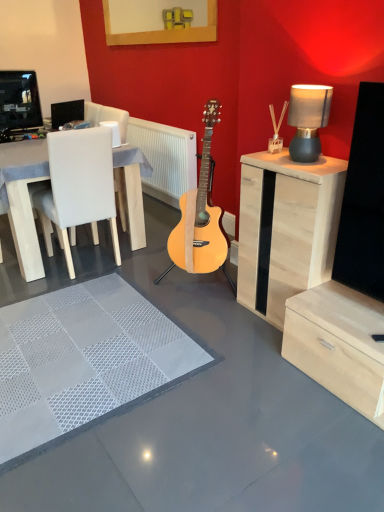
This screenshot has height=512, width=384. What do you see at coordinates (164, 31) in the screenshot?
I see `wooden picture frame at upper center` at bounding box center [164, 31].

Identify the location of light wood cabinet at right. The image size is (384, 512). (286, 228).

The width and height of the screenshot is (384, 512). Describe the element at coordinates (308, 120) in the screenshot. I see `matte gray lampshade at upper right` at that location.

Find the location of a particular element. The height and width of the screenshot is (512, 384). black plastic speaker at upper left is located at coordinates (66, 112).

In order to click on wooden picture frame at upper center in this screenshot , I will do `click(164, 31)`.

From a real-world perspective, which object rests below the other?

light wood acoustic guitar at center, from a real-world perspective.

Consider the image. What's the angular difference between light wood acoustic guitar at center and matte gray lampshade at upper right's facing directions?

They differ by 2.68 degrees in their facing directions.

Is light wood acoustic guitar at center taller than matte gray lampshade at upper right?

Correct, light wood acoustic guitar at center is much taller as matte gray lampshade at upper right.

Considering the relative sizes of light wood acoustic guitar at center and matte gray lampshade at upper right in the image provided, is light wood acoustic guitar at center thinner than matte gray lampshade at upper right?

In fact, light wood acoustic guitar at center might be wider than matte gray lampshade at upper right.

How many degrees apart are the facing directions of light wood cabinet at right and matte gray lampshade at upper right?

They differ by 2.68 degrees in their facing directions.

Is point (318, 268) less distant than point (319, 144)?

Yes.

Is light wood cabinet at right with matte gray lampshade at upper right?

No, light wood cabinet at right is not beside matte gray lampshade at upper right.

Considering the relative positions of black plastic speaker at upper left and light wood acoustic guitar at center in the image provided, is black plastic speaker at upper left in front of light wood acoustic guitar at center?

No, the depth of black plastic speaker at upper left is greater than that of light wood acoustic guitar at center.

Are black plastic speaker at upper left and light wood acoustic guitar at center located far from each other?

Yes.

Is black plastic speaker at upper left situated inside light wood acoustic guitar at center or outside?

The correct answer is: outside.

From a real-world perspective, is light wood cabinet at right physically above white textured rug at center?

Yes, from a real-world perspective, light wood cabinet at right is above white textured rug at center.

Who is taller, light wood cabinet at right or white textured rug at center?

With more height is light wood cabinet at right.

Is point (276, 277) closer or farther from the camera than point (129, 389)?

Point (276, 277) appears to be farther away from the viewer than point (129, 389).

Which object is thinner, light wood cabinet at right or white textured rug at center?

With smaller width is light wood cabinet at right.

Between white textured rug at center and white textured radiator at center, which one is positioned behind?

white textured radiator at center is further from the camera.

From the image's perspective, relative to white textured radiator at center, is white textured rug at center above or below?

white textured rug at center is situated lower than white textured radiator at center in the image.

Which of these two, white textured rug at center or white textured radiator at center, stands taller?

white textured radiator at center.

How many degrees apart are the facing directions of white textured rug at center and white textured radiator at center?

The angle between the facing direction of white textured rug at center and the facing direction of white textured radiator at center is 88.7 degrees.

Are white textured radiator at center and black plastic speaker at upper left located far from each other?

Absolutely, white textured radiator at center is distant from black plastic speaker at upper left.

What's the angular difference between white textured radiator at center and black plastic speaker at upper left's facing directions?

3.3 degrees.

Can you confirm if white textured radiator at center is positioned to the right of black plastic speaker at upper left?

Yes.

Does white textured radiator at center lie in front of black plastic speaker at upper left?

No, white textured radiator at center is further to the viewer.

Is white textured radiator at center outside of wooden picture frame at upper center?

white textured radiator at center lies outside wooden picture frame at upper center's area.

Are white textured radiator at center and wooden picture frame at upper center beside each other?

No, white textured radiator at center is not beside wooden picture frame at upper center.

Between white textured radiator at center and wooden picture frame at upper center, which one has larger size?

white textured radiator at center is bigger.

You are a GUI agent. You are given a task and a screenshot of the screen. Output one action in this format:
    pyautogui.click(x=<x>, y=<y>)
    Task: Click on the table lamp in front of the light wood acoustic guitar at center
    
    Given the screenshot: What is the action you would take?
    [x=308, y=120]

I want to click on cabinetry on the left of matte gray lampshade at upper right, so click(286, 228).

Which object lies further to the anchor point light wood acoustic guitar at center, wooden picture frame at upper center or white textured radiator at center?

Based on the image, wooden picture frame at upper center appears to be further to light wood acoustic guitar at center.

When comparing their distances from white textured rug at center, does light wood cabinet at right or light wood acoustic guitar at center seem further?

The object further to white textured rug at center is light wood acoustic guitar at center.

Estimate the real-world distances between objects in this image. Which object is further from light wood acoustic guitar at center, white textured radiator at center or white textured rug at center?

white textured radiator at center is positioned further to the anchor light wood acoustic guitar at center.

Estimate the real-world distances between objects in this image. Which object is closer to white textured radiator at center, light wood cabinet at right or matte gray lampshade at upper right?

Among the two, light wood cabinet at right is located nearer to white textured radiator at center.

From the image, which object appears to be farther from light wood acoustic guitar at center, white leather chair at left or white textured rug at center?

white textured rug at center is further to light wood acoustic guitar at center.

When comparing their distances from white textured rug at center, does matte gray lampshade at upper right or white leather chair at left seem further?

matte gray lampshade at upper right is further to white textured rug at center.

Estimate the real-world distances between objects in this image. Which object is closer to black plastic speaker at upper left, light wood acoustic guitar at center or wooden picture frame at upper center?

wooden picture frame at upper center lies closer to black plastic speaker at upper left than the other object.

Considering their positions, is black plastic speaker at upper left positioned closer to light wood cabinet at right than matte gray lampshade at upper right?

Among the two, matte gray lampshade at upper right is located nearer to light wood cabinet at right.

Where is `cabinetry between white leather chair at left and matte gray lampshade at upper right in the horizontal direction`? The image size is (384, 512). cabinetry between white leather chair at left and matte gray lampshade at upper right in the horizontal direction is located at coordinates (286, 228).

You are a GUI agent. You are given a task and a screenshot of the screen. Output one action in this format:
    pyautogui.click(x=<x>, y=<y>)
    Task: Click on the radiator that lies between wooden picture frame at upper center and light wood cabinet at right from top to bottom
    Image resolution: width=384 pixels, height=512 pixels.
    Given the screenshot: What is the action you would take?
    pyautogui.click(x=166, y=158)

What are the coordinates of `guitar between white textured rug at center and white textured radiator at center along the z-axis` in the screenshot? It's located at (201, 215).

Identify the location of chair between black plastic speaker at upper left and matte gray lampshade at upper right in the horizontal direction. The height and width of the screenshot is (512, 384). (78, 187).